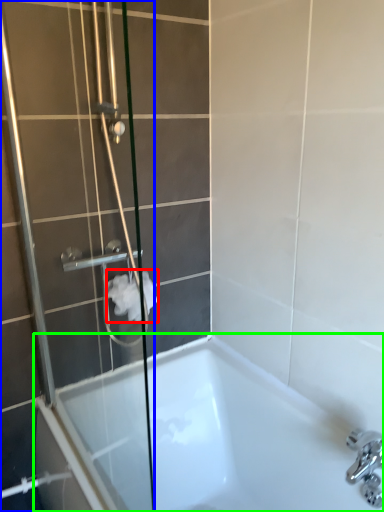
Question: Which object is positioned farthest from toilet paper (highlighted by a red box)? Select from shower door (highlighted by a blue box) and bathtub (highlighted by a green box).

Choices:
 (A) shower door
 (B) bathtub

Answer: (B)